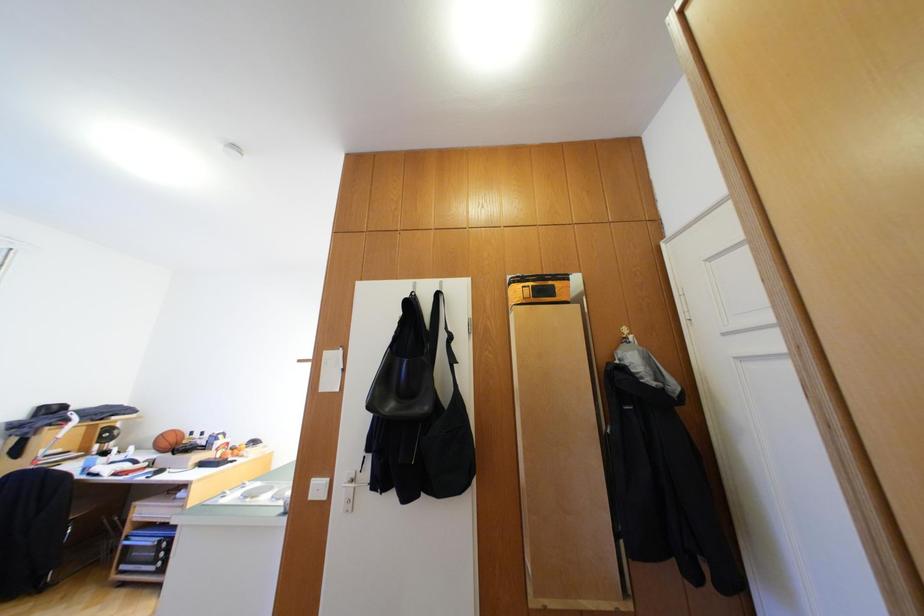
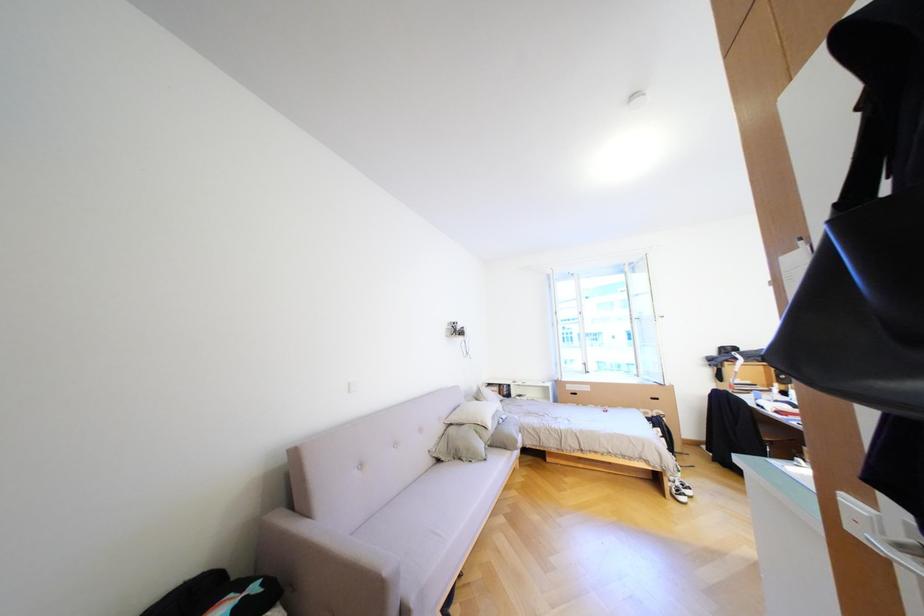
Question: How did the camera likely rotate?

Choices:
 (A) Left
 (B) Right
 (C) Up
 (D) Down

Answer: (A)